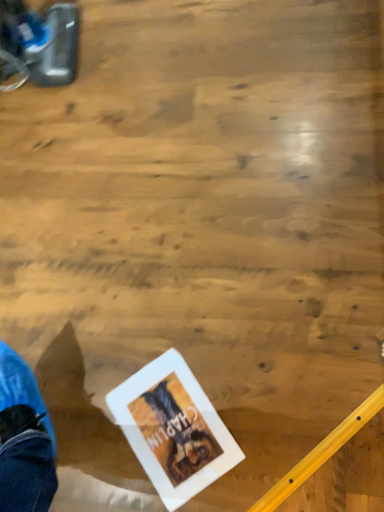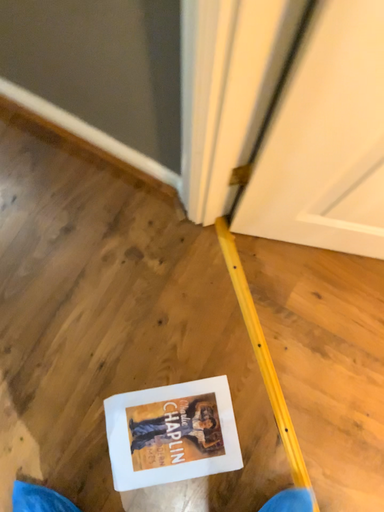
Question: Which way did the camera rotate in the video?

Choices:
 (A) rotated upward
 (B) rotated downward

Answer: (A)